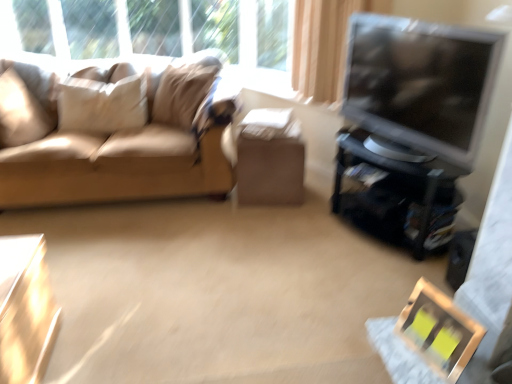
This screenshot has height=384, width=512. In order to click on wooden picture frame at lower right in this screenshot , I will do coord(438,331).

Identify the location of beige leather couch at left. This screenshot has height=384, width=512. (112, 132).

Measure the distance between point (478, 126) and camera.

Point (478, 126) and camera are 6.09 feet apart.

This screenshot has height=384, width=512. What do you see at coordinates (270, 165) in the screenshot? I see `matte cardboard box at center, placed as the first table when sorted from top to bottom` at bounding box center [270, 165].

Describe the element at coordinates (396, 196) in the screenshot. Image resolution: width=512 pixels, height=384 pixels. I see `matte black tv stand at right` at that location.

This screenshot has height=384, width=512. I want to click on smooth beige carpet at center, so click(218, 292).

Between point (184, 283) and point (117, 124), which one is positioned in front?

Point (184, 283)

Is smooth beige carpet at center positioned beyond the bounds of beige fabric pillow at upper left, the second pillow positioned from the left?

Yes.

From the image's perspective, is smooth beige carpet at center positioned above or below beige fabric pillow at upper left, positioned as the second pillow in right-to-left order?

smooth beige carpet at center is below beige fabric pillow at upper left, positioned as the second pillow in right-to-left order.

Does matte black tv stand at right have a smaller size compared to beige leather couch at left?

Yes.

Is matte black tv stand at right in contact with beige leather couch at left?

No, matte black tv stand at right is not next to beige leather couch at left.

Considering the relative sizes of matte black tv stand at right and beige leather couch at left in the image provided, is matte black tv stand at right taller than beige leather couch at left?

No.

From a real-world perspective, is matte black tv stand at right under beige leather couch at left?

Yes.

Can you tell me how much beige fabric pillow at upper left, which is the 3th pillow from left to right, and matte black tv stand at right differ in facing direction?

20.8 degrees separate the facing orientations of beige fabric pillow at upper left, which is the 3th pillow from left to right, and matte black tv stand at right.

Is beige fabric pillow at upper left, the first pillow viewed from the right, directly adjacent to matte black tv stand at right?

No, beige fabric pillow at upper left, the first pillow viewed from the right, is not making contact with matte black tv stand at right.

Could you measure the distance between beige fabric pillow at upper left, the first pillow viewed from the right, and matte black tv stand at right?

beige fabric pillow at upper left, the first pillow viewed from the right, is 3.91 feet from matte black tv stand at right.

Is beige fabric pillow at upper left, the first pillow viewed from the right, oriented away from matte black tv stand at right?

beige fabric pillow at upper left, the first pillow viewed from the right, is not turned away from matte black tv stand at right.

Considering the relative sizes of smooth beige carpet at center and matte black tv stand at right in the image provided, is smooth beige carpet at center thinner than matte black tv stand at right?

Incorrect, the width of smooth beige carpet at center is not less than that of matte black tv stand at right.

Based on their sizes in the image, would you say smooth beige carpet at center is bigger or smaller than matte black tv stand at right?

smooth beige carpet at center is smaller than matte black tv stand at right.

Considering the sizes of objects smooth beige carpet at center and matte black tv stand at right in the image provided, who is shorter, smooth beige carpet at center or matte black tv stand at right?

smooth beige carpet at center.

How different are the orientations of smooth beige carpet at center and matte black tv stand at right in degrees?

The angle between the facing direction of smooth beige carpet at center and the facing direction of matte black tv stand at right is 114 degrees.

Which object is thinner, suede beige pillow at left, the third pillow positioned from the right, or smooth beige carpet at center?

With smaller width is suede beige pillow at left, the third pillow positioned from the right.

Is suede beige pillow at left, the third pillow positioned from the right, touching smooth beige carpet at center?

suede beige pillow at left, the third pillow positioned from the right, and smooth beige carpet at center are clearly separated.

From a real-world perspective, who is located higher, suede beige pillow at left, the third pillow positioned from the right, or smooth beige carpet at center?

suede beige pillow at left, the third pillow positioned from the right, is physically above.

Is smooth beige carpet at center a part of suede beige pillow at left, which is counted as the first pillow, starting from the left?

No.

Considering the relative sizes of matte cardboard box at center, the second table in the front-to-back sequence, and beige fabric pillow at upper left, the first pillow viewed from the right, in the image provided, is matte cardboard box at center, the second table in the front-to-back sequence, bigger than beige fabric pillow at upper left, the first pillow viewed from the right,?

No, matte cardboard box at center, the second table in the front-to-back sequence, is not bigger than beige fabric pillow at upper left, the first pillow viewed from the right.

Is point (289, 149) farther from camera compared to point (163, 122)?

No, it is not.

Which object is further away from the camera taking this photo, matte cardboard box at center, which is the first table from right to left, or beige fabric pillow at upper left, the first pillow viewed from the right?

matte cardboard box at center, which is the first table from right to left, is more distant.

Is beige fabric pillow at upper left, positioned as the second pillow in right-to-left order, facing away from matte black tv stand at right?

No, beige fabric pillow at upper left, positioned as the second pillow in right-to-left order, is not facing away from matte black tv stand at right.

Considering the relative sizes of beige fabric pillow at upper left, the second pillow positioned from the left, and matte black tv stand at right in the image provided, is beige fabric pillow at upper left, the second pillow positioned from the left, bigger than matte black tv stand at right?

Actually, beige fabric pillow at upper left, the second pillow positioned from the left, might be smaller than matte black tv stand at right.

Does beige fabric pillow at upper left, the second pillow positioned from the left, have a greater width compared to matte black tv stand at right?

No.

Does beige fabric pillow at upper left, positioned as the second pillow in right-to-left order, touch matte black tv stand at right?

beige fabric pillow at upper left, positioned as the second pillow in right-to-left order, is not next to matte black tv stand at right, and they're not touching.

Image resolution: width=512 pixels, height=384 pixels. I want to click on plain below the beige fabric pillow at upper left, positioned as the second pillow in right-to-left order (from a real-world perspective), so click(218, 292).

Image resolution: width=512 pixels, height=384 pixels. Find the location of `entertainment center that is on the right side of beige leather couch at left`. entertainment center that is on the right side of beige leather couch at left is located at coordinates (396, 196).

Looking at the image, which one is located closer to wooden picture frame at lower right, matte black tv stand at right or matte cardboard box at center, which is the first table from right to left?

matte black tv stand at right is positioned closer to the anchor wooden picture frame at lower right.

When comparing their distances from matte black tv at right, does shiny metallic table at lower left, placed as the 1th table when sorted from front to back, or beige leather couch at left seem closer?

beige leather couch at left.

Based on the photo, estimate the real-world distances between objects in this image. Which object is further from wooden picture frame at lower right, beige fabric pillow at upper left, positioned as the second pillow in right-to-left order, or beige leather couch at left?

Based on the image, beige fabric pillow at upper left, positioned as the second pillow in right-to-left order, appears to be further to wooden picture frame at lower right.

Which object lies further to the anchor point suede beige pillow at left, which is counted as the first pillow, starting from the left, wooden picture frame at lower right or beige fabric pillow at upper left, which is the 3th pillow from left to right?

wooden picture frame at lower right is further to suede beige pillow at left, which is counted as the first pillow, starting from the left.

Based on their spatial positions, is wooden picture frame at lower right or beige fabric pillow at upper left, the second pillow positioned from the left, closer to matte black tv at right?

wooden picture frame at lower right is positioned closer to the anchor matte black tv at right.

Looking at this image, which object lies further to the anchor point beige fabric pillow at upper left, positioned as the second pillow in right-to-left order, smooth beige carpet at center or wooden picture frame at lower right?

Based on the image, wooden picture frame at lower right appears to be further to beige fabric pillow at upper left, positioned as the second pillow in right-to-left order.

Which object lies nearer to the anchor point beige leather couch at left, matte black tv at right or smooth beige carpet at center?

The object closer to beige leather couch at left is smooth beige carpet at center.

Which object lies nearer to the anchor point smooth beige carpet at center, beige leather couch at left or matte black tv at right?

Based on the image, beige leather couch at left appears to be nearer to smooth beige carpet at center.

You are a GUI agent. You are given a task and a screenshot of the screen. Output one action in this format:
    pyautogui.click(x=<x>, y=<y>)
    Task: Click on the pillow between beige leather couch at left and matte black tv at right in the horizontal direction
    The height and width of the screenshot is (384, 512).
    Given the screenshot: What is the action you would take?
    pyautogui.click(x=184, y=88)

In order to click on plain situated between shiny metallic table at lower left, the 2th table viewed from the top, and matte black tv at right from left to right in this screenshot , I will do `click(218, 292)`.

You are a GUI agent. You are given a task and a screenshot of the screen. Output one action in this format:
    pyautogui.click(x=<x>, y=<y>)
    Task: Click on the table between shiny metallic table at lower left, the 1th table when ordered from bottom to top, and matte black tv at right, in the horizontal direction
    
    Given the screenshot: What is the action you would take?
    pyautogui.click(x=270, y=165)

This screenshot has width=512, height=384. In order to click on table located between beige fabric pillow at upper left, which is the 3th pillow from left to right, and matte black tv at right in the left-right direction in this screenshot , I will do `click(270, 165)`.